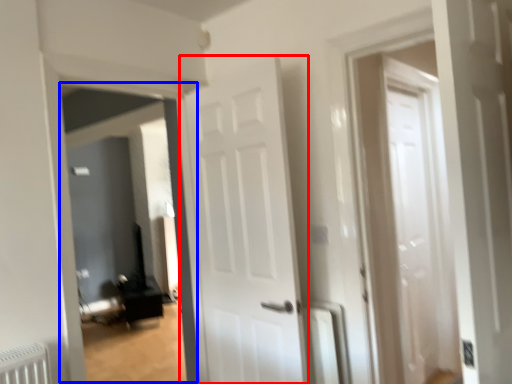
Question: Which object appears closest to the camera in this image, door (highlighted by a red box) or corridor (highlighted by a blue box)?

Choices:
 (A) door
 (B) corridor

Answer: (A)